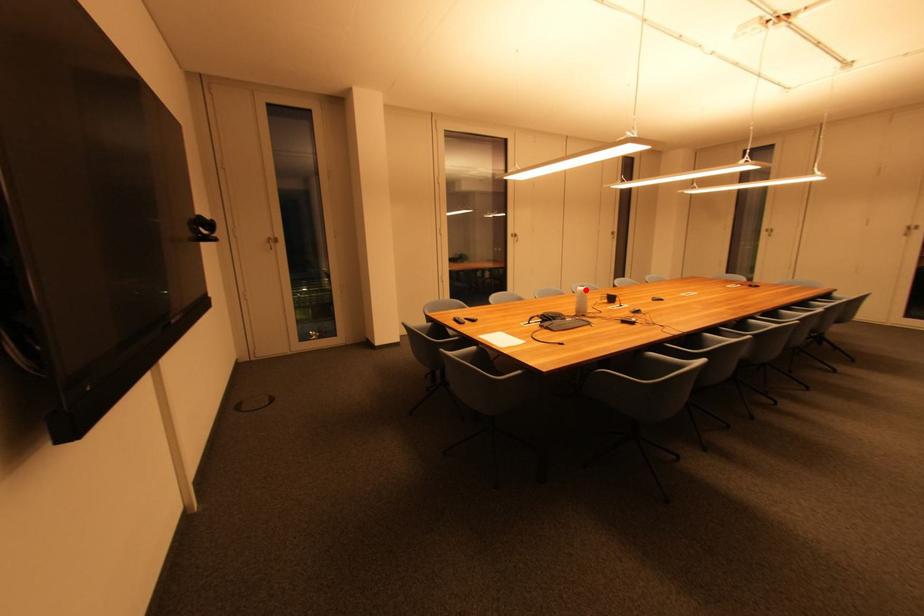
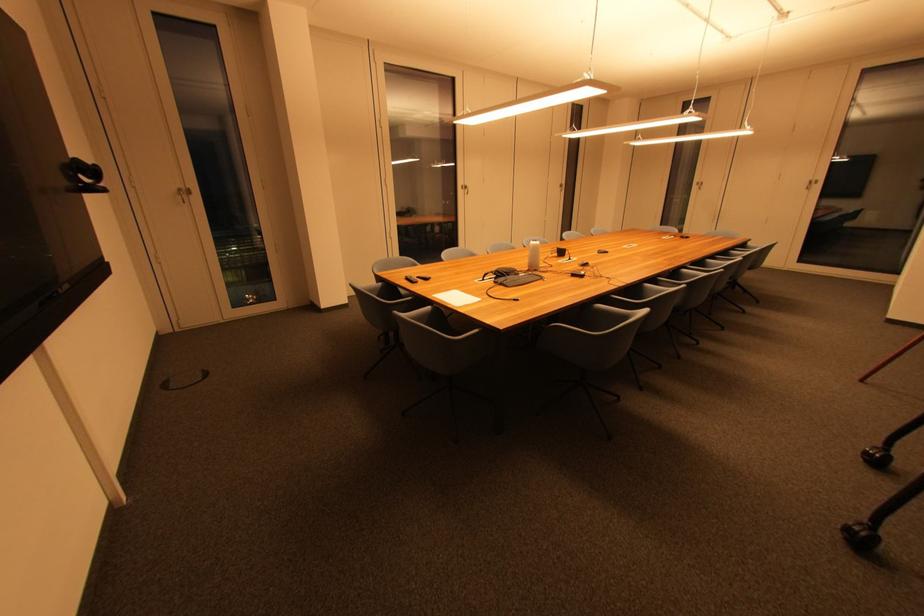
Question: A red point is marked in image1. In image2, is the corresponding 3D point closer to the camera or farther? Reply with the corresponding letter.

Choices:
 (A) The corresponding 3D point is closer.
 (B) The corresponding 3D point is farther.

Answer: (B)